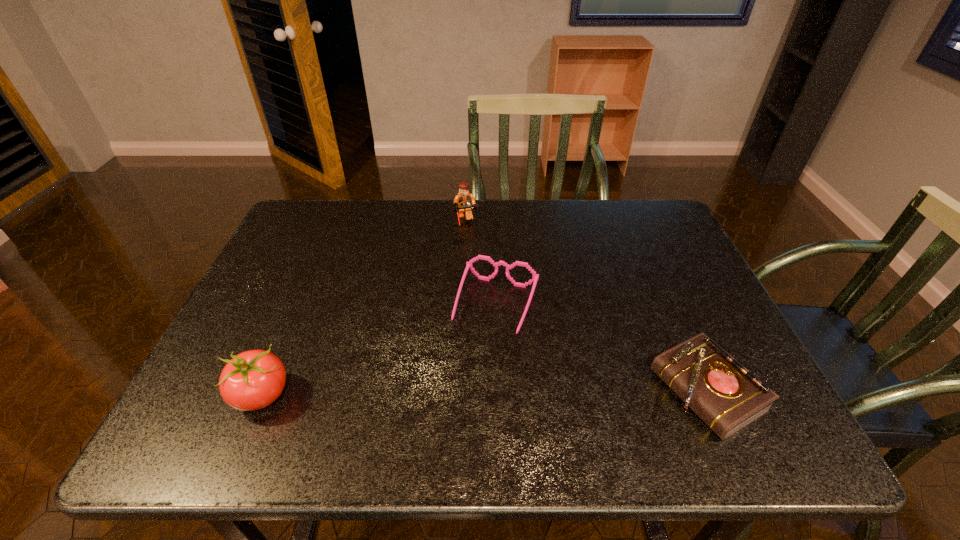
The image size is (960, 540). I want to click on tomato, so click(252, 380).

The image size is (960, 540). I want to click on the rightmost object, so [722, 392].

The height and width of the screenshot is (540, 960). In order to click on diary in this screenshot , I will do `click(722, 392)`.

Identify the location of the farthest object. The image size is (960, 540). (464, 202).

You are a GUI agent. You are given a task and a screenshot of the screen. Output one action in this format:
    pyautogui.click(x=<x>, y=<y>)
    Task: Click on the second farthest object
    
    Given the screenshot: What is the action you would take?
    pyautogui.click(x=535, y=277)

I want to click on vacant space positioned on the right of the tomato, so click(376, 395).

The width and height of the screenshot is (960, 540). Find the location of `vacant region located 0.180m on the left of the rightmost object`. vacant region located 0.180m on the left of the rightmost object is located at coordinates (568, 391).

Find the location of a particular element. The width and height of the screenshot is (960, 540). vacant space located holding a crossbow in the hands of the Lego is located at coordinates (473, 260).

Find the location of a particular element. The width and height of the screenshot is (960, 540). free location located 0.260m holding a crossbow in the hands of the Lego is located at coordinates (485, 294).

Locate an element on the screen. The image size is (960, 540). vacant region located 0.070m holding a crossbow in the hands of the Lego is located at coordinates (470, 249).